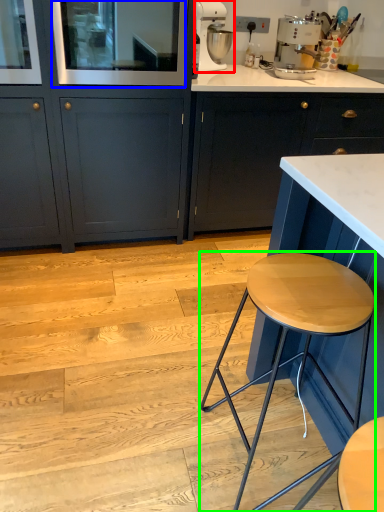
Question: Estimate the real-world distances between objects in this image. Which object is closer to kitchen appliance (highlighted by a red box), glass door (highlighted by a blue box) or stool (highlighted by a green box)?

Choices:
 (A) glass door
 (B) stool

Answer: (A)